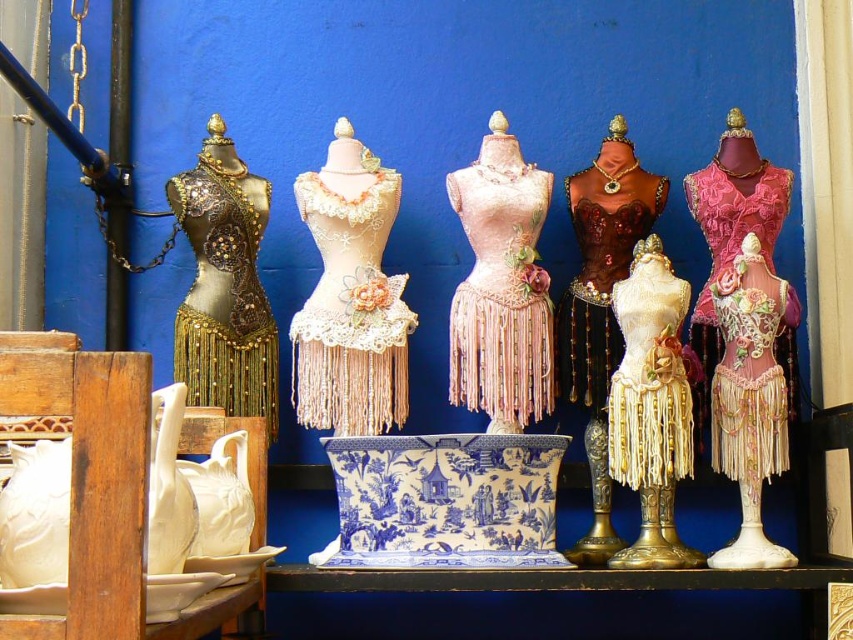
Looking at this image, does lace fabric dress at center have a larger size compared to shiny brown fabric corset at center?

Correct, lace fabric dress at center is larger in size than shiny brown fabric corset at center.

Between point (329, 212) and point (563, 321), which one is positioned in front?

Point (329, 212)

Locate an element on the screen. This screenshot has height=640, width=853. lace fabric dress at center is located at coordinates (351, 312).

Is point (329, 449) closer to viewer compared to point (450, 342)?

Yes, point (329, 449) is closer to viewer.

Is blue and white porcelain vase at center bigger than satin beige dress at center?

Correct, blue and white porcelain vase at center is larger in size than satin beige dress at center.

Is point (351, 532) positioned before point (488, 275)?

Yes, point (351, 532) is in front of point (488, 275).

At what (x,y) coordinates should I click in order to perform the action: click on blue and white porcelain vase at center. Please return your answer as a coordinate pair (x, y). Image resolution: width=853 pixels, height=640 pixels. Looking at the image, I should click on (444, 500).

Does blue and white porcelain vase at center appear under gold fringed dress form at center?

Indeed, blue and white porcelain vase at center is positioned under gold fringed dress form at center.

Where is `blue and white porcelain vase at center`? This screenshot has width=853, height=640. blue and white porcelain vase at center is located at coordinates (444, 500).

Looking at this image, who is more forward, (479, 547) or (665, 371)?

Positioned in front is point (479, 547).

At what (x,y) coordinates should I click in order to perform the action: click on blue and white porcelain vase at center. Please return your answer as a coordinate pair (x, y). This screenshot has height=640, width=853. Looking at the image, I should click on (444, 500).